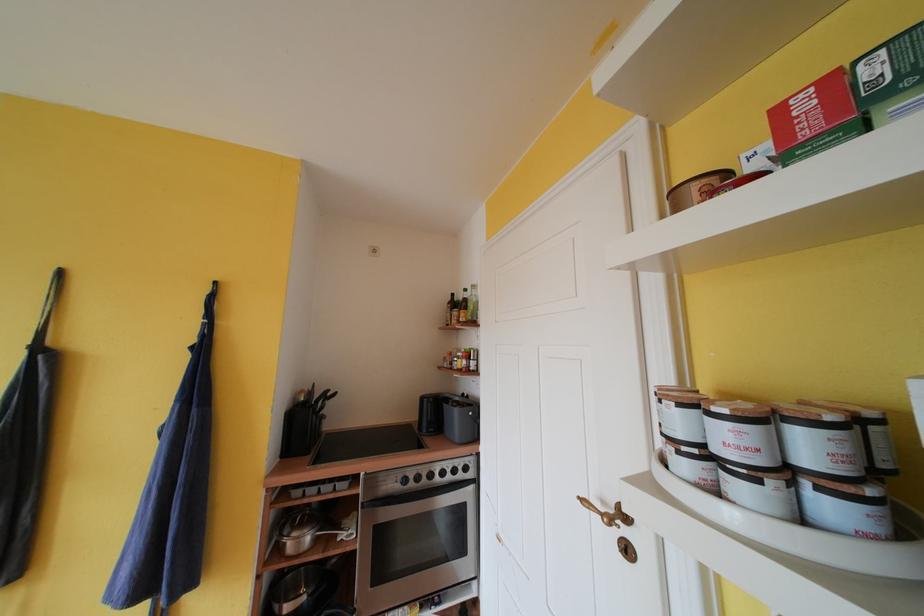
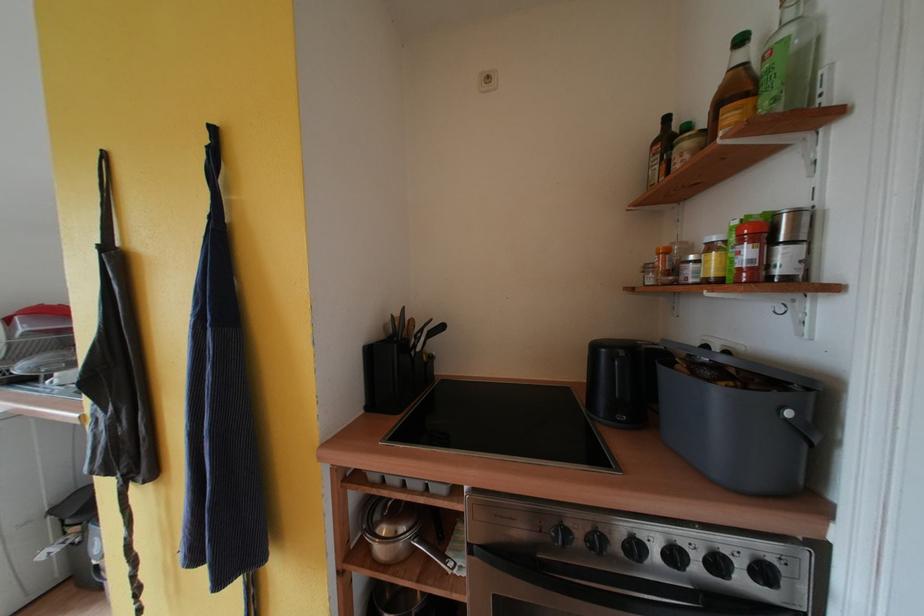
Find the pixel in the second image that matches (314,462) in the first image.

(399, 426)